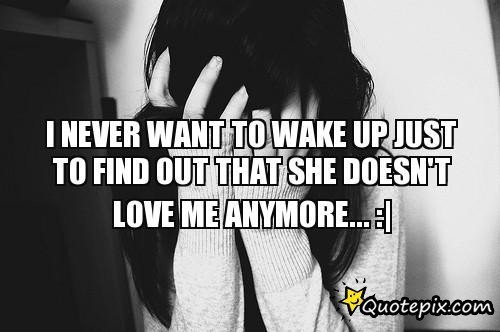
Find the location of a particular element. Image resolution: width=500 pixels, height=332 pixels. wall is located at coordinates (422, 39).